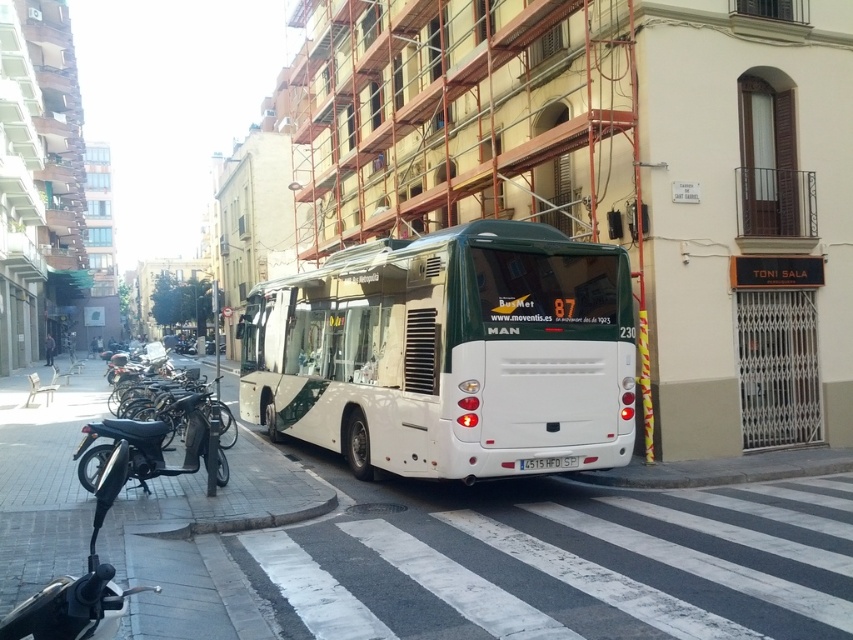
From the picture: You are standing at the pedestrian crossing and want to take a photo of the bus. Which of the two points, point [125,426] or point [566,460], is closer to your camera when capturing the image?

Point [125,426] is closer to the camera than point [566,460].

You are a pedestrian standing at the pedestrian crossing. You want to cross the street to the other side. Is there a clear path between the white matte bus at center and the shiny black motorcycle at lower left?

The white matte bus at center is positioned over the shiny black motorcycle at lower left, so there is no clear path between them. You should look for another route to cross the street safely.